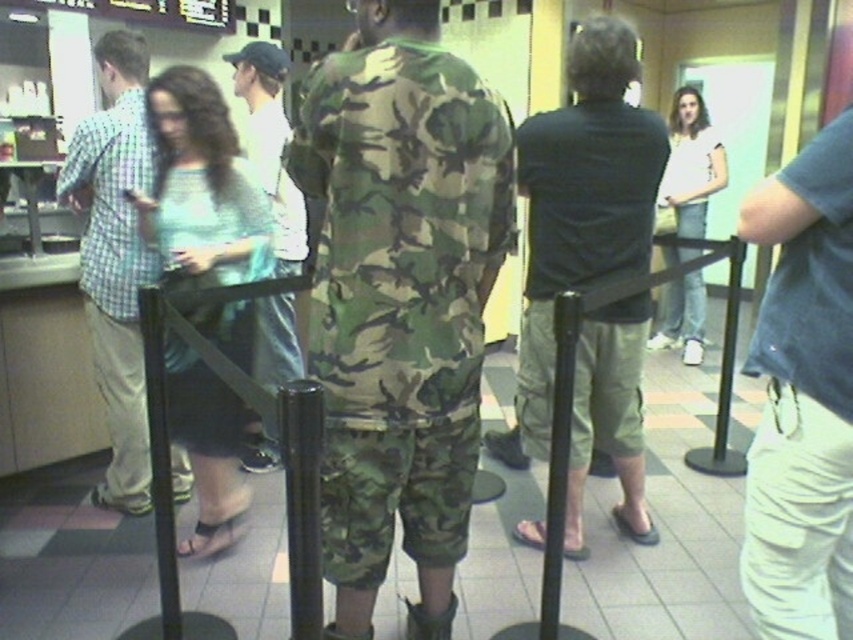
Measure the distance between camo fabric uniform at center and checkered fabric shirt at left.

A distance of 1.23 meters exists between camo fabric uniform at center and checkered fabric shirt at left.

Does camo fabric uniform at center have a lesser height compared to checkered fabric shirt at left?

Indeed, camo fabric uniform at center has a lesser height compared to checkered fabric shirt at left.

What do you see at coordinates (399, 292) in the screenshot?
I see `camo fabric uniform at center` at bounding box center [399, 292].

Locate an element on the screen. The height and width of the screenshot is (640, 853). camo fabric uniform at center is located at coordinates (399, 292).

Is point (158, 499) in front of point (664, 256)?

Yes, point (158, 499) is closer to viewer.

Who is positioned more to the left, black plastic pole at center or white cotton shirt at upper right?

From the viewer's perspective, black plastic pole at center appears more on the left side.

From the picture: Measure the distance between point (148,320) and camera.

Point (148,320) and camera are 6.30 feet apart from each other.

Locate an element on the screen. black plastic pole at center is located at coordinates (158, 472).

Can you confirm if checkered fabric shirt at left is taller than white cotton shirt at upper right?

Yes.

Find the location of `checkered fabric shirt at left`. checkered fabric shirt at left is located at coordinates (115, 259).